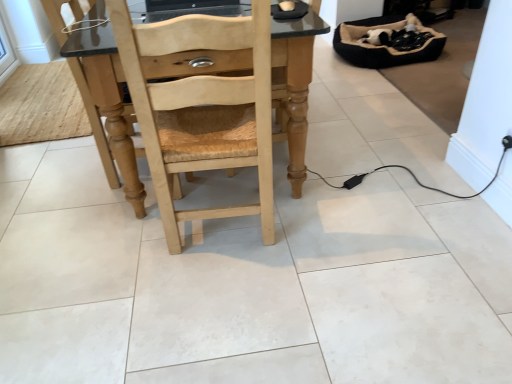
Where is `vacant space that is to the left of natural wood chair at center`? vacant space that is to the left of natural wood chair at center is located at coordinates (116, 247).